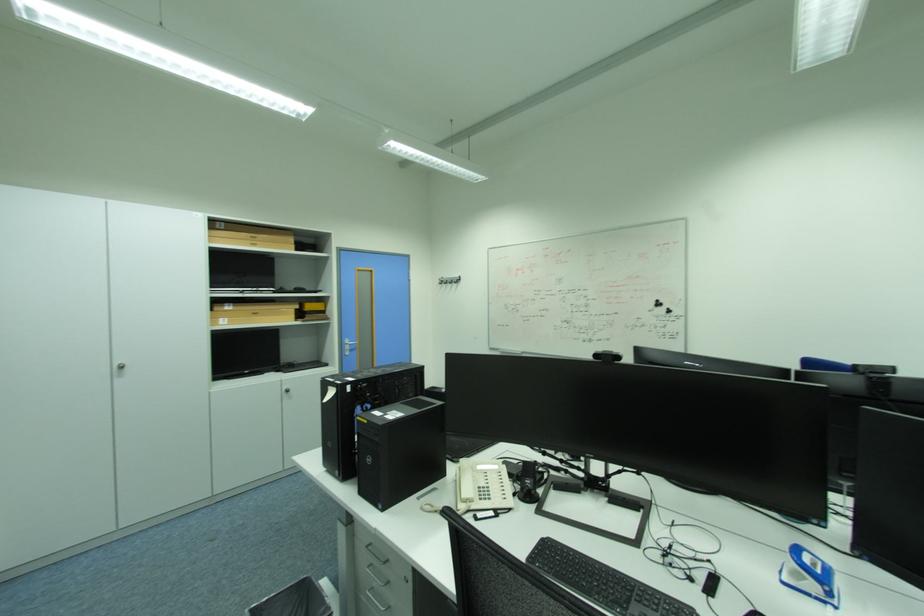
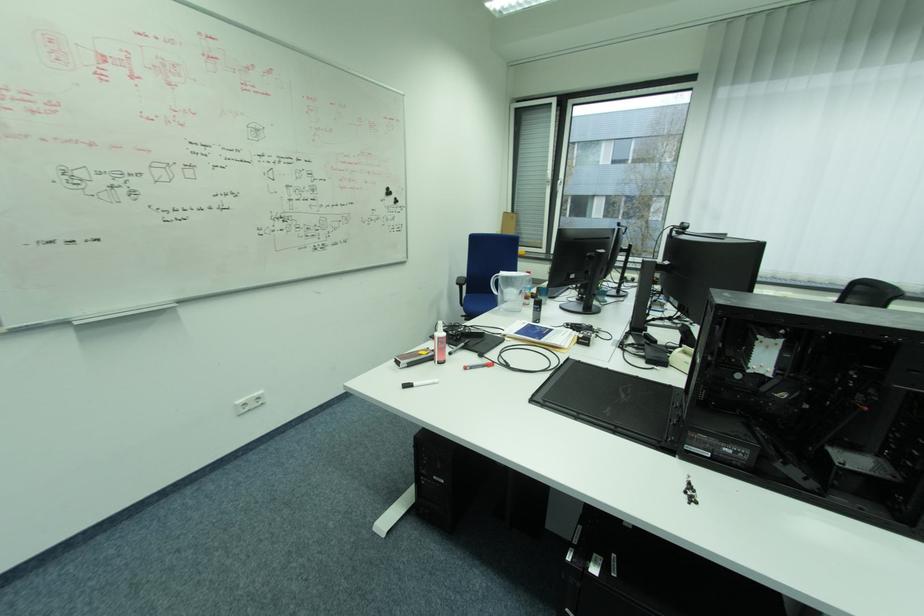
Where in the second image is the point corresponding to point (662, 304) from the first image?

(392, 192)